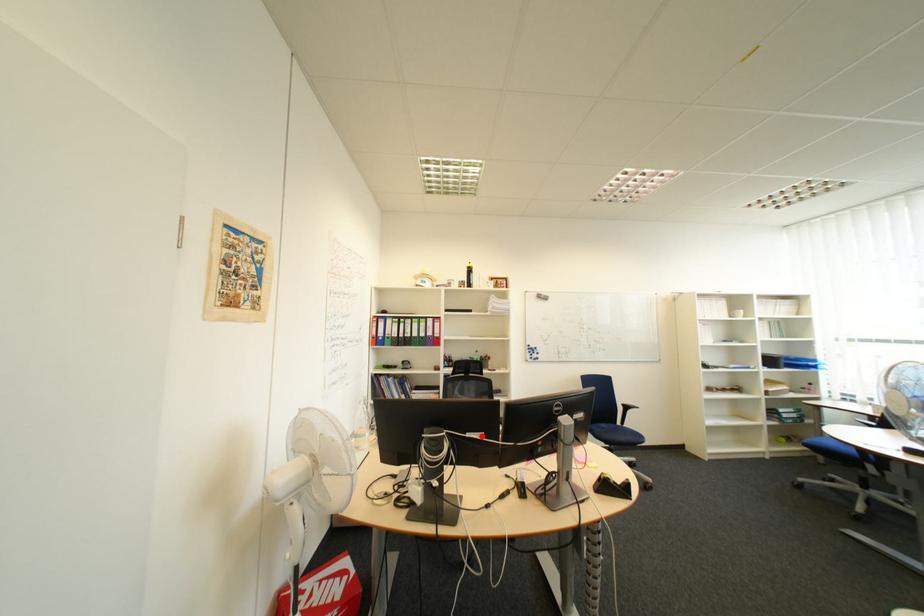
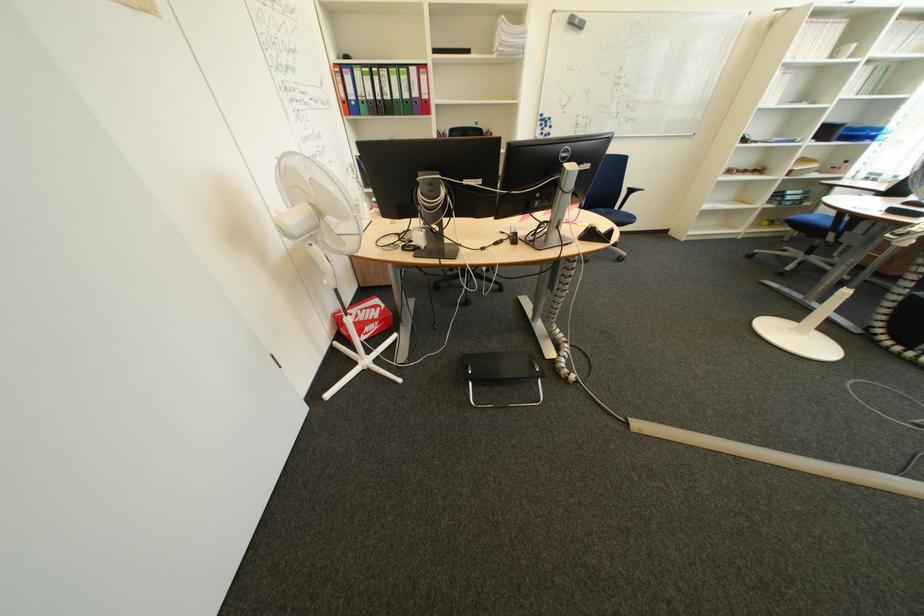
Question: I am providing you with two images of the same scene from different viewpoints. Given a red point in image1, look at the same physical point in image2. Is it:

Choices:
 (A) Closer to the viewpoint
 (B) Farther from the viewpoint

Answer: (A)